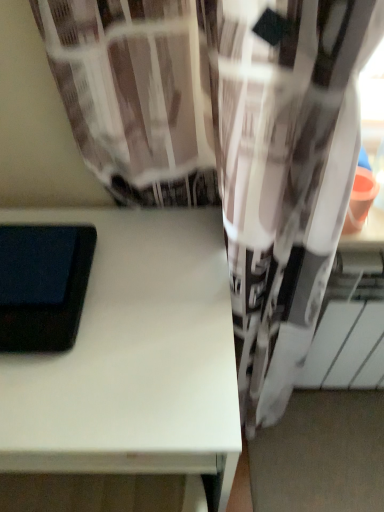
Where is `empty space that is ontop of white matte table at center (from a real-world perspective)`? This screenshot has width=384, height=512. empty space that is ontop of white matte table at center (from a real-world perspective) is located at coordinates (116, 320).